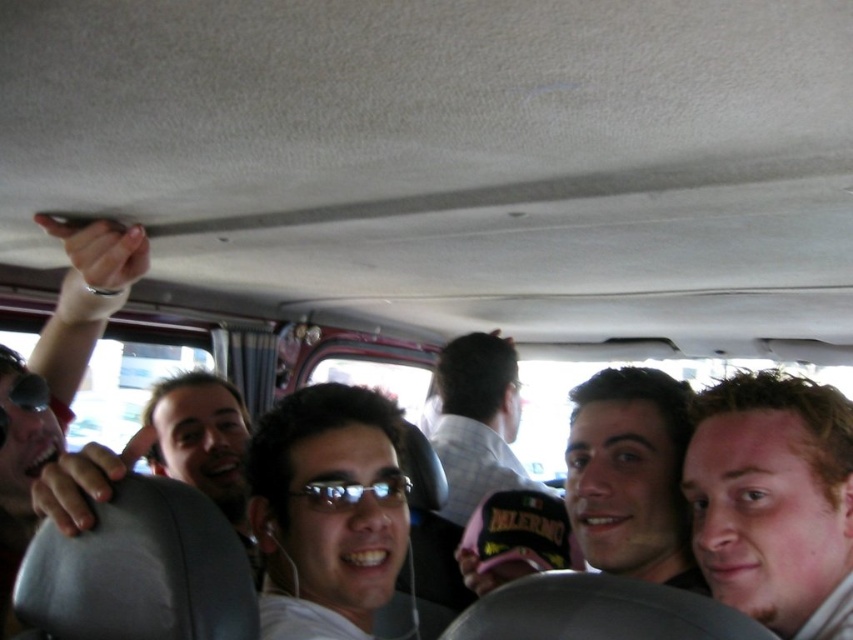
Question: Based on their relative distances, which object is farther from the clear plastic glasses at center?

Choices:
 (A) light brown hair at center
 (B) pink fabric cap at center
 (C) matte black sunglasses at upper left
 (D) white checkered shirt at center

Answer: (D)

Question: Among these points, which one is nearest to the camera?

Choices:
 (A) (575, 392)
 (B) (328, 477)

Answer: (B)

Question: Does matte black sunglasses at upper left come behind clear plastic glasses at center?

Choices:
 (A) no
 (B) yes

Answer: (B)

Question: Which point appears closest to the camera in this image?

Choices:
 (A) tap(328, 476)
 (B) tap(451, 352)
 (C) tap(1, 541)
 (D) tap(662, 428)

Answer: (A)

Question: Can you confirm if light brown hair at center is wider than white checkered shirt at center?

Choices:
 (A) yes
 (B) no

Answer: (B)

Question: Considering the relative positions of light brown hair at center and clear plastic glasses at center in the image provided, where is light brown hair at center located with respect to clear plastic glasses at center?

Choices:
 (A) below
 (B) above

Answer: (B)